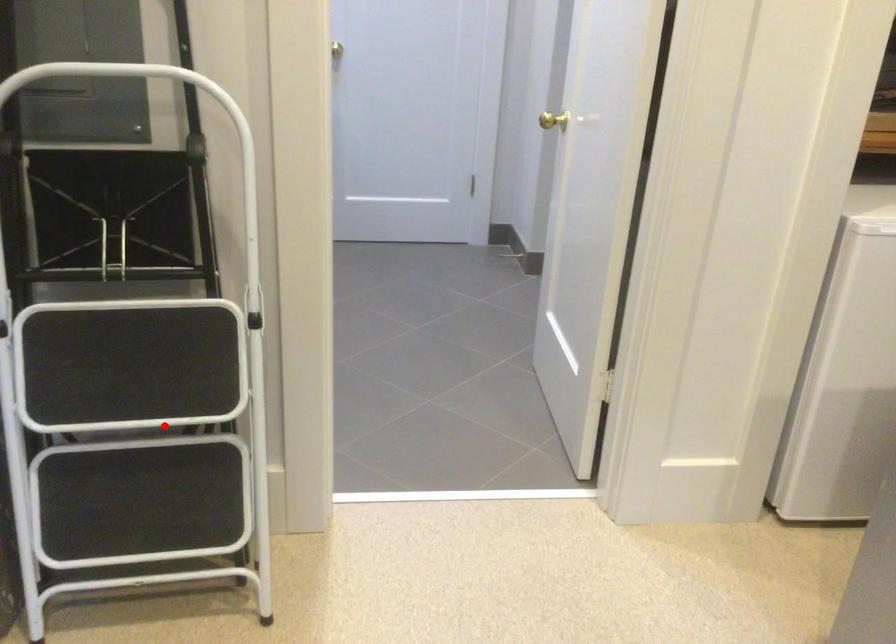
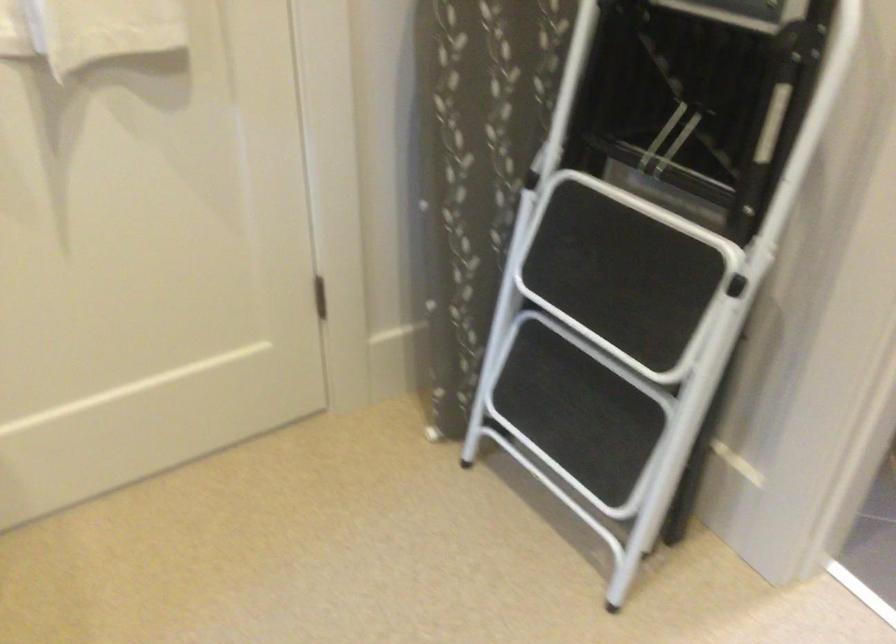
Question: I am providing you with two images of the same scene from different viewpoints. Given a red point in image1, look at the same physical point in image2. Is it:

Choices:
 (A) Closer to the viewpoint
 (B) Farther from the viewpoint

Answer: (A)